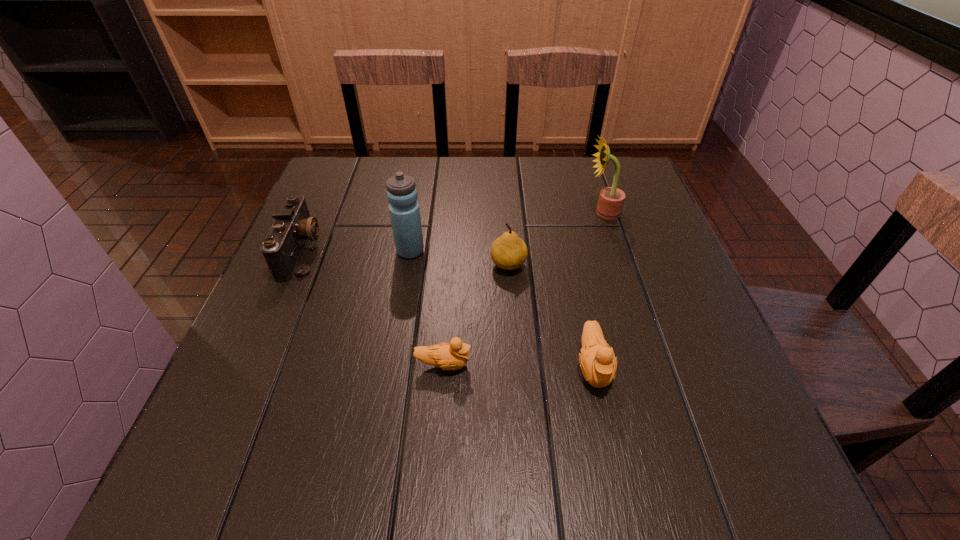
The width and height of the screenshot is (960, 540). I want to click on vacant area at the near edge of the desktop, so (540, 387).

This screenshot has width=960, height=540. I want to click on vacant area at the left edge, so click(x=327, y=241).

The image size is (960, 540). What are the coordinates of `free space at the right edge of the desktop` in the screenshot? It's located at (674, 346).

In order to click on free location at the far left corner of the desktop in this screenshot , I will do `click(368, 180)`.

I want to click on free space at the far right corner of the desktop, so click(x=629, y=168).

This screenshot has width=960, height=540. I want to click on free space at the near right corner of the desktop, so click(x=713, y=388).

This screenshot has width=960, height=540. Find the location of `free spot between the shorter duckling and the water bottle`. free spot between the shorter duckling and the water bottle is located at coordinates (427, 308).

Where is `vacant area that lies between the leftmost object and the fifth object from right to left`? vacant area that lies between the leftmost object and the fifth object from right to left is located at coordinates (356, 251).

Image resolution: width=960 pixels, height=540 pixels. In order to click on free space between the fourth object from left to right and the sunflower in this screenshot , I will do `click(556, 239)`.

Identify the location of vacant area that lies between the right duckling and the camera. This screenshot has height=540, width=960. (447, 308).